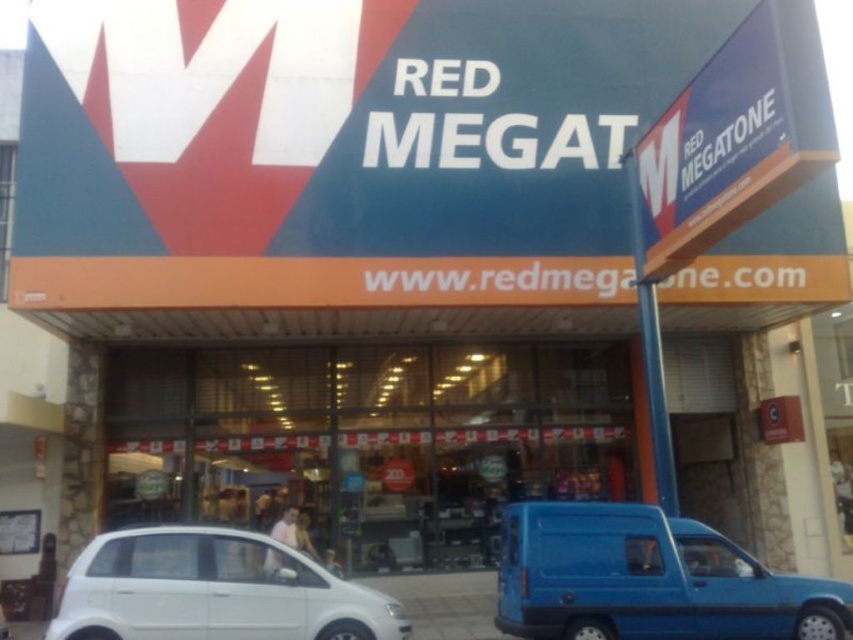
Does blue matte van at lower right have a smaller size compared to white matte hatchback at lower left?

Incorrect, blue matte van at lower right is not smaller in size than white matte hatchback at lower left.

Which is above, blue matte van at lower right or white matte hatchback at lower left?

Positioned higher is white matte hatchback at lower left.

Between point (619, 572) and point (347, 620), which one is positioned behind?

The point (619, 572) is behind.

This screenshot has height=640, width=853. What are the coordinates of `blue matte van at lower right` in the screenshot? It's located at (648, 579).